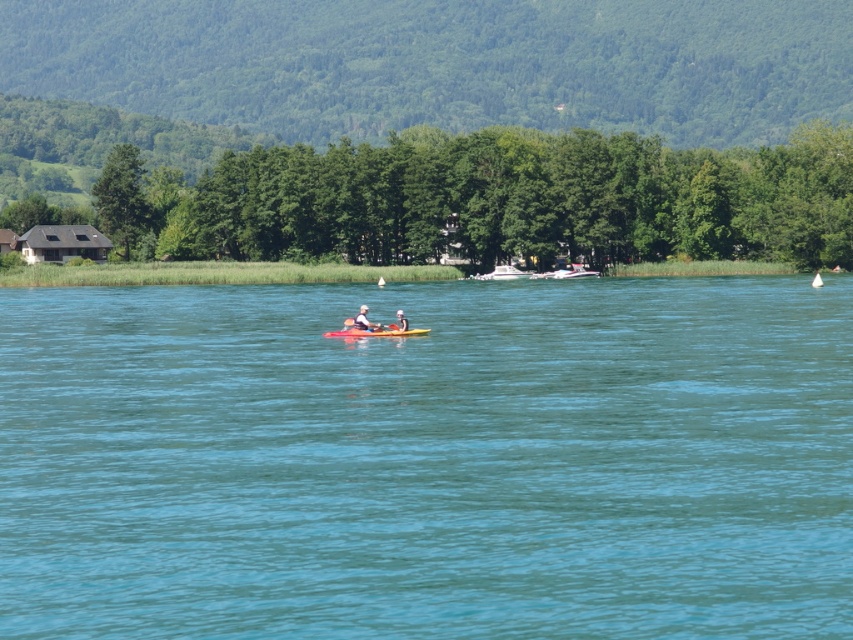
Question: Does matte white canoe at center appear under matte yellow kayak at center?

Choices:
 (A) yes
 (B) no

Answer: (A)

Question: Does clear blue water at center appear under yellow plastic kayak at center?

Choices:
 (A) no
 (B) yes

Answer: (B)

Question: Which of these objects is positioned closest to the white glossy boat at center?

Choices:
 (A) matte yellow kayak at center
 (B) matte white canoe at center
 (C) white plastic boat at center

Answer: (C)

Question: Is green leafy trees at center to the right of matte yellow kayak at center from the viewer's perspective?

Choices:
 (A) yes
 (B) no

Answer: (B)

Question: Considering the real-world distances, which object is farthest from the yellow plastic kayak at center?

Choices:
 (A) matte yellow kayak at center
 (B) white plastic boat at center
 (C) matte white canoe at center

Answer: (B)

Question: Among these objects, which one is farthest from the camera?

Choices:
 (A) matte yellow kayak at center
 (B) yellow plastic kayak at center

Answer: (A)